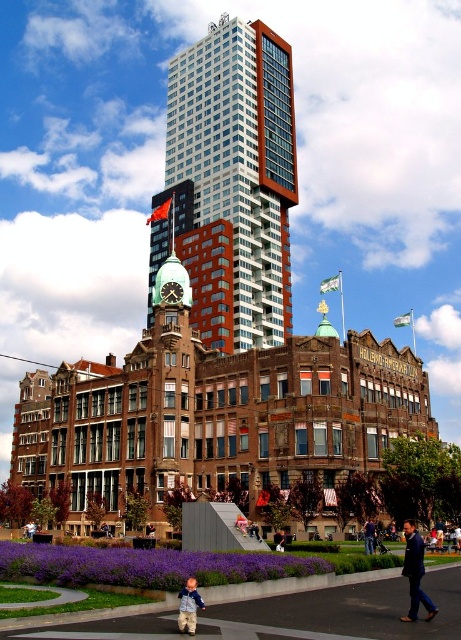
Does light blue denim jacket at lower center have a lesser width compared to dark blue jeans at lower center?

Indeed, light blue denim jacket at lower center has a lesser width compared to dark blue jeans at lower center.

Which is more to the left, light blue denim jacket at lower center or dark blue jeans at lower center?

Positioned to the left is light blue denim jacket at lower center.

Find the location of a particular element. The width and height of the screenshot is (461, 640). light blue denim jacket at lower center is located at coordinates (189, 605).

Is dark blue suit at lower right to the right of light blue denim jacket at lower center from the viewer's perspective?

Correct, you'll find dark blue suit at lower right to the right of light blue denim jacket at lower center.

Who is more distant from viewer, (406, 536) or (177, 595)?

Positioned behind is point (406, 536).

The image size is (461, 640). What do you see at coordinates (414, 573) in the screenshot?
I see `dark blue suit at lower right` at bounding box center [414, 573].

The width and height of the screenshot is (461, 640). In order to click on dark blue suit at lower right in this screenshot , I will do `click(414, 573)`.

Between white glass skyscraper at center and dark blue suit at lower right, which one appears on the left side from the viewer's perspective?

Positioned to the left is white glass skyscraper at center.

Can you confirm if white glass skyscraper at center is positioned below dark blue suit at lower right?

No, white glass skyscraper at center is not below dark blue suit at lower right.

Which is behind, point (243, 168) or point (409, 552)?

Positioned behind is point (243, 168).

Where is `white glass skyscraper at center`? This screenshot has width=461, height=640. white glass skyscraper at center is located at coordinates [234, 180].